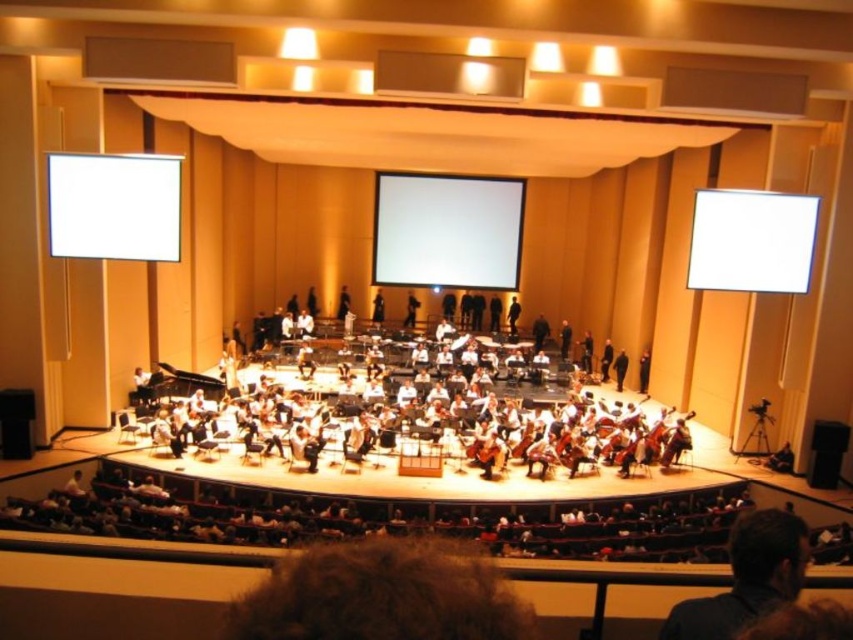
Is black fabric coat at center thinner than black fabric at center?

Yes.

Measure the distance between point (625,369) and camera.

Point (625,369) is 73.85 feet away from camera.

Between point (612, 365) and point (381, 307), which one is positioned behind?

The point (381, 307) is behind.

Where is `black fabric coat at center`? The image size is (853, 640). black fabric coat at center is located at coordinates (619, 369).

Does white glossy orchestra at center appear on the left side of white glossy screen at upper right?

Correct, you'll find white glossy orchestra at center to the left of white glossy screen at upper right.

Identify the location of white glossy orchestra at center. The image size is (853, 640). (436, 404).

Measure the distance from white glossy screen at upper right to black fabric coat at center.

white glossy screen at upper right and black fabric coat at center are 25.20 feet apart from each other.

Who is shorter, white glossy screen at upper right or black fabric coat at center?

black fabric coat at center is shorter.

Locate an element on the screen. The width and height of the screenshot is (853, 640). white glossy screen at upper right is located at coordinates (751, 241).